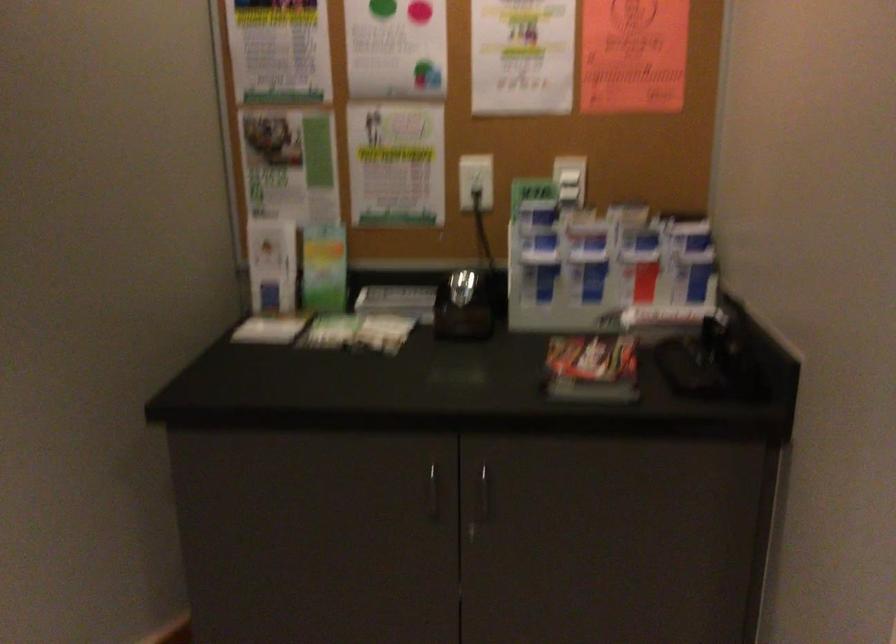
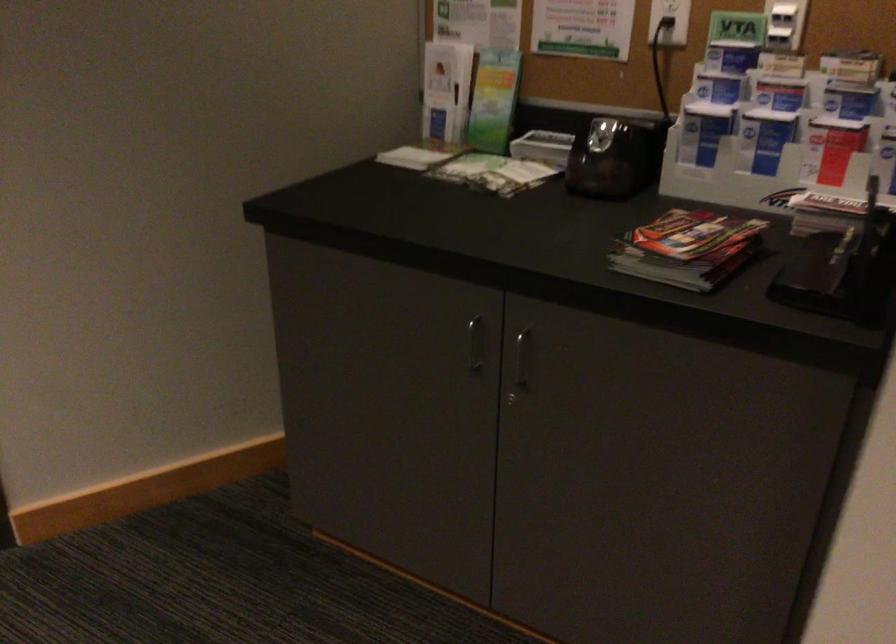
Question: The images are taken continuously from a first-person perspective. In which direction is your viewpoint rotating?

Choices:
 (A) Left
 (B) Right
 (C) Up
 (D) Down

Answer: (A)